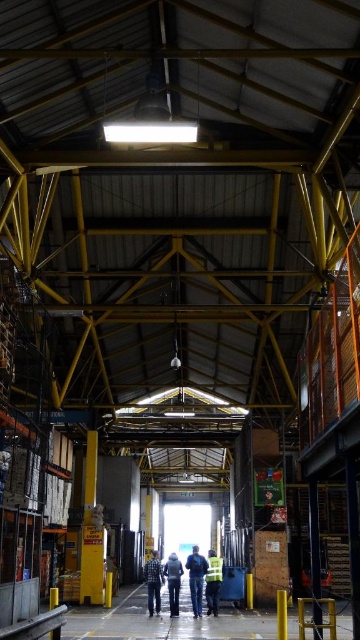
Is yellow matte pillar at center to the left of blue denim jeans at center from the viewer's perspective?

Indeed, yellow matte pillar at center is positioned on the left side of blue denim jeans at center.

This screenshot has height=640, width=360. I want to click on yellow matte pillar at center, so [x=91, y=531].

Locate an element on the screen. The width and height of the screenshot is (360, 640). yellow matte pillar at center is located at coordinates (91, 531).

Between yellow matte pillar at center and denim jacket at center, which one appears on the left side from the viewer's perspective?

yellow matte pillar at center is more to the left.

Describe the element at coordinates (91, 531) in the screenshot. I see `yellow matte pillar at center` at that location.

Where is `yellow matte pillar at center`? yellow matte pillar at center is located at coordinates coord(91,531).

Locate an element on the screen. yellow matte pillar at center is located at coordinates [x=91, y=531].

Which is in front, point (83, 516) or point (217, 579)?

Point (217, 579) is in front.

Where is `yellow matte pillar at center`? This screenshot has width=360, height=640. yellow matte pillar at center is located at coordinates (91, 531).